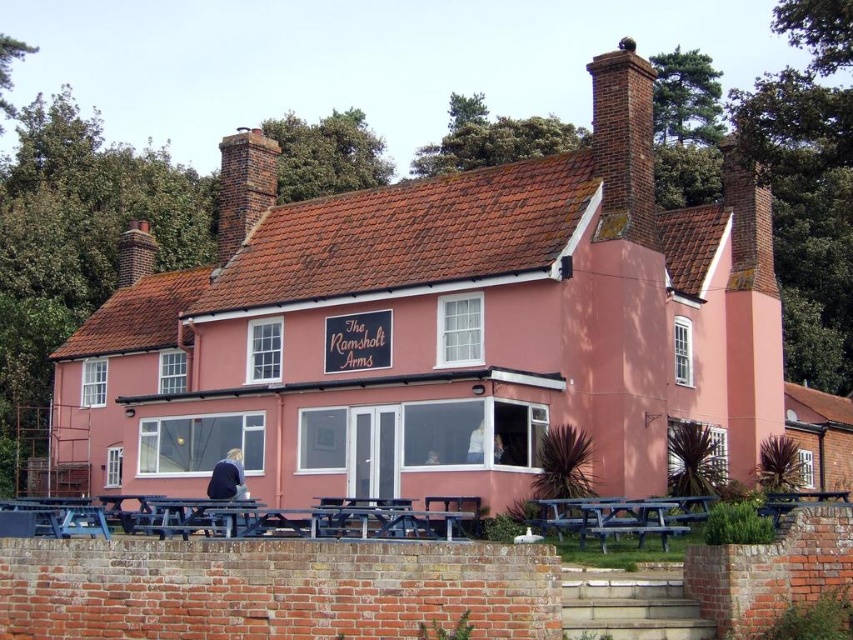
Question: Which of the following is the farthest from the observer?

Choices:
 (A) brown brick chimney at upper left
 (B) brick chimney at upper center

Answer: (A)

Question: Does brick chimney at upper center appear on the right side of brown brick chimney at upper left?

Choices:
 (A) no
 (B) yes

Answer: (B)

Question: Is the position of brick chimney at upper center more distant than that of brown brick chimney at upper left?

Choices:
 (A) no
 (B) yes

Answer: (A)

Question: Which object is closer to the camera taking this photo?

Choices:
 (A) brown brick chimney at upper left
 (B) brick chimney at upper center

Answer: (B)

Question: Is brick chimney at upper center positioned behind brown brick chimney at upper left?

Choices:
 (A) yes
 (B) no

Answer: (B)